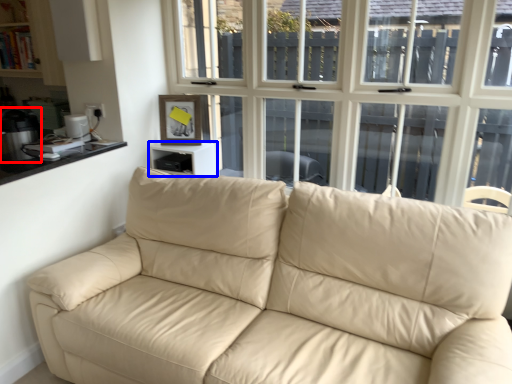
Question: Among these objects, which one is farthest to the camera, appliance (highlighted by a red box) or table (highlighted by a blue box)?

Choices:
 (A) appliance
 (B) table

Answer: (B)